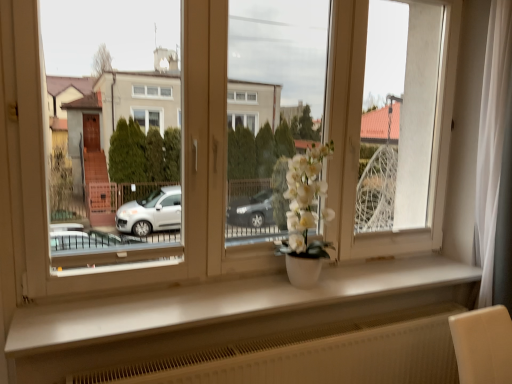
Question: From the image's perspective, is white matte vase at center above white matte flower pot at center?

Choices:
 (A) no
 (B) yes

Answer: (A)

Question: Could you tell me if white matte vase at center is turned towards white matte flower pot at center?

Choices:
 (A) yes
 (B) no

Answer: (B)

Question: Is white matte vase at center looking in the opposite direction of white matte flower pot at center?

Choices:
 (A) yes
 (B) no

Answer: (A)

Question: Considering the relative sizes of white matte vase at center and white matte flower pot at center in the image provided, is white matte vase at center taller than white matte flower pot at center?

Choices:
 (A) yes
 (B) no

Answer: (B)

Question: Considering the relative positions of white matte vase at center and white matte flower pot at center in the image provided, is white matte vase at center to the right of white matte flower pot at center from the viewer's perspective?

Choices:
 (A) yes
 (B) no

Answer: (A)

Question: Is white matte flower pot at center bigger or smaller than white matte window sill at center?

Choices:
 (A) small
 (B) big

Answer: (B)

Question: From the image's perspective, is white matte flower pot at center located above or below white matte window sill at center?

Choices:
 (A) below
 (B) above

Answer: (B)

Question: From a real-world perspective, is white matte flower pot at center positioned above or below white matte window sill at center?

Choices:
 (A) above
 (B) below

Answer: (A)

Question: Is white matte flower pot at center wider or thinner than white matte window sill at center?

Choices:
 (A) thin
 (B) wide

Answer: (A)

Question: From a real-world perspective, is white matte window sill at center physically located above or below white matte vase at center?

Choices:
 (A) above
 (B) below

Answer: (B)

Question: Based on their sizes in the image, would you say white matte window sill at center is bigger or smaller than white matte vase at center?

Choices:
 (A) small
 (B) big

Answer: (A)

Question: Looking at their shapes, would you say white matte window sill at center is wider or thinner than white matte vase at center?

Choices:
 (A) thin
 (B) wide

Answer: (B)

Question: Choose the correct answer: Is white matte window sill at center inside white matte vase at center or outside it?

Choices:
 (A) inside
 (B) outside

Answer: (B)

Question: Is white matte vase at center inside or outside of white matte window sill at center?

Choices:
 (A) inside
 (B) outside

Answer: (B)

Question: Is white matte vase at center wider or thinner than white matte window sill at center?

Choices:
 (A) wide
 (B) thin

Answer: (B)